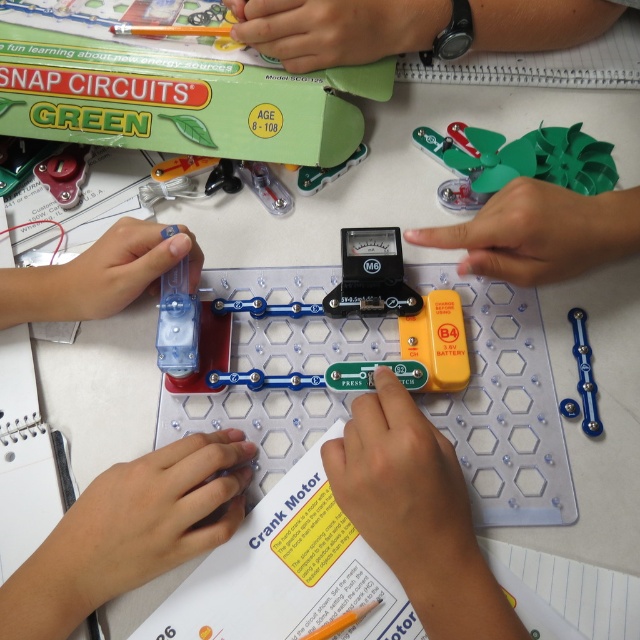
You are a child trying to assemble the Snap Circuits Green kit. You have a metallic red screw at upper left and a metallic blue gear at center. Which component should you place first if you want to follow the left to right assembly sequence?

You should place the metallic red screw at upper left first because it is positioned on the left side of the metallic blue gear at center, following the left to right assembly sequence.

You are a teacher observing the children working with the Snap Circuits Green kit. You notice the blue metallic gear at center and the metallic red screw at upper left. Which object would cast a longer shadow if the light is coming from above?

The blue metallic gear at center is much taller than the metallic red screw at upper left, so it would cast a longer shadow.